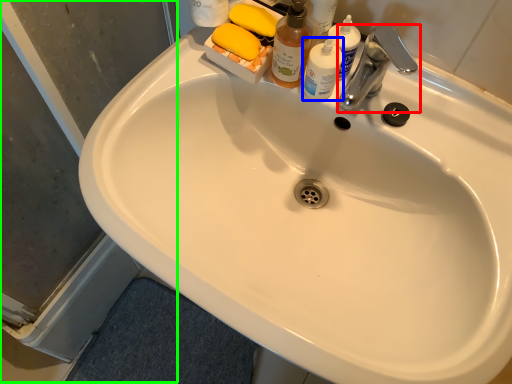
Question: Estimate the real-world distances between objects in this image. Which object is farther from tap (highlighted by a red box), toiletry (highlighted by a blue box) or screen door (highlighted by a green box)?

Choices:
 (A) toiletry
 (B) screen door

Answer: (B)